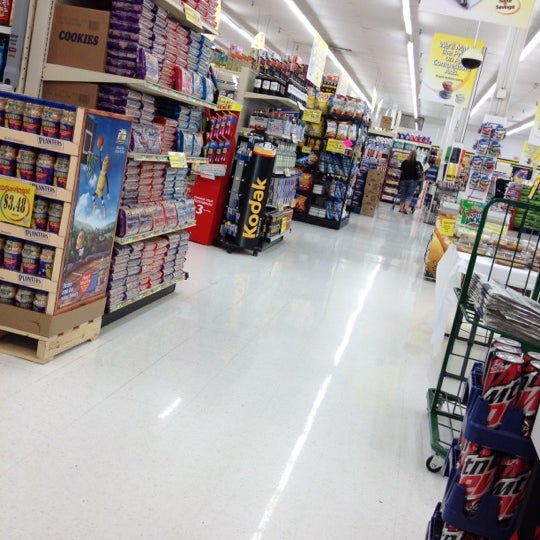
Image resolution: width=540 pixels, height=540 pixels. I want to click on floor freezer, so click(450, 264), click(465, 244).